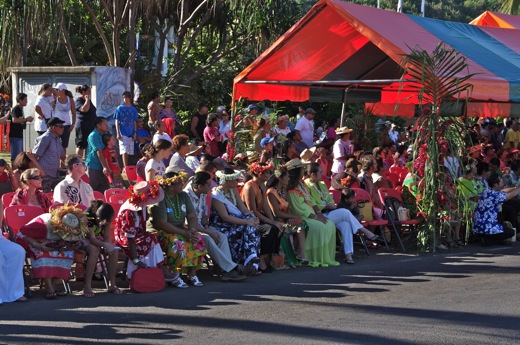
Where is `red chairs`? The image size is (520, 345). red chairs is located at coordinates (18, 212), (5, 197), (45, 196), (100, 196), (108, 190), (119, 198), (129, 172), (372, 219), (384, 194), (168, 123).